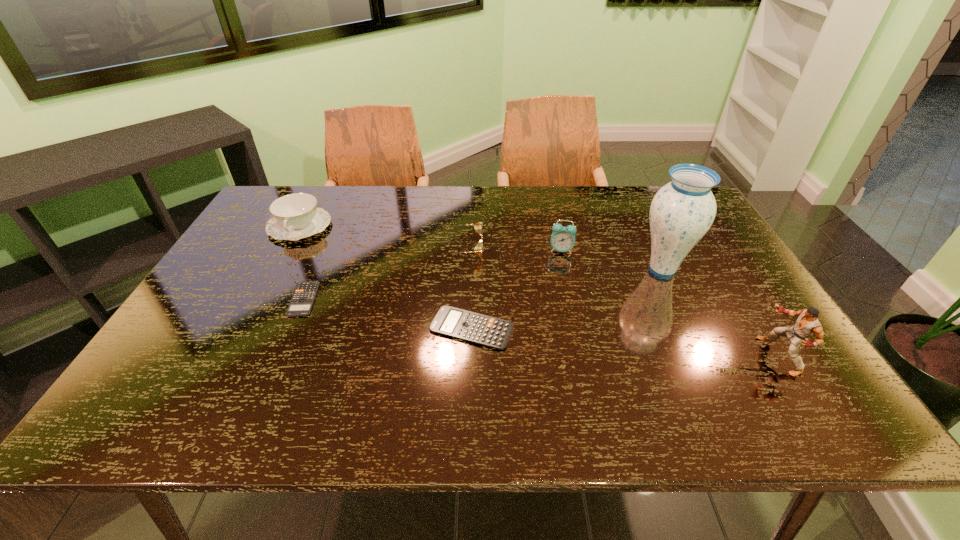
Locate an element on the screen. The height and width of the screenshot is (540, 960). puncher is located at coordinates (807, 325).

Image resolution: width=960 pixels, height=540 pixels. I want to click on the second tallest object, so click(x=807, y=325).

At what (x,y) coordinates should I click in order to perform the action: click on vacant area located on the back of the left calculator. Please return your answer as a coordinate pair (x, y). The height and width of the screenshot is (540, 960). Looking at the image, I should click on (342, 211).

Identify the location of vacant space situated 0.380m on the left of the right calculator. This screenshot has width=960, height=540. (273, 328).

Locate an element on the screen. This screenshot has width=960, height=540. free location located 0.330m on the front lenses of the fifth tallest object is located at coordinates (594, 249).

At what (x,y) coordinates should I click in order to perform the action: click on vacant space positioned on the handle side of the chinaware. Please return your answer as a coordinate pair (x, y). This screenshot has width=960, height=540. Looking at the image, I should click on (279, 264).

This screenshot has width=960, height=540. What are the coordinates of `free location located 0.380m on the left of the second object from right to left` in the screenshot? It's located at (499, 270).

Find the location of `vacant space positioned on the face of the fifth shortest object`. vacant space positioned on the face of the fifth shortest object is located at coordinates (569, 288).

I want to click on free region located 0.380m on the front-facing side of the second tallest object, so click(597, 356).

This screenshot has width=960, height=540. Find the location of `vacant region located 0.160m on the front-facing side of the second tallest object`. vacant region located 0.160m on the front-facing side of the second tallest object is located at coordinates (694, 356).